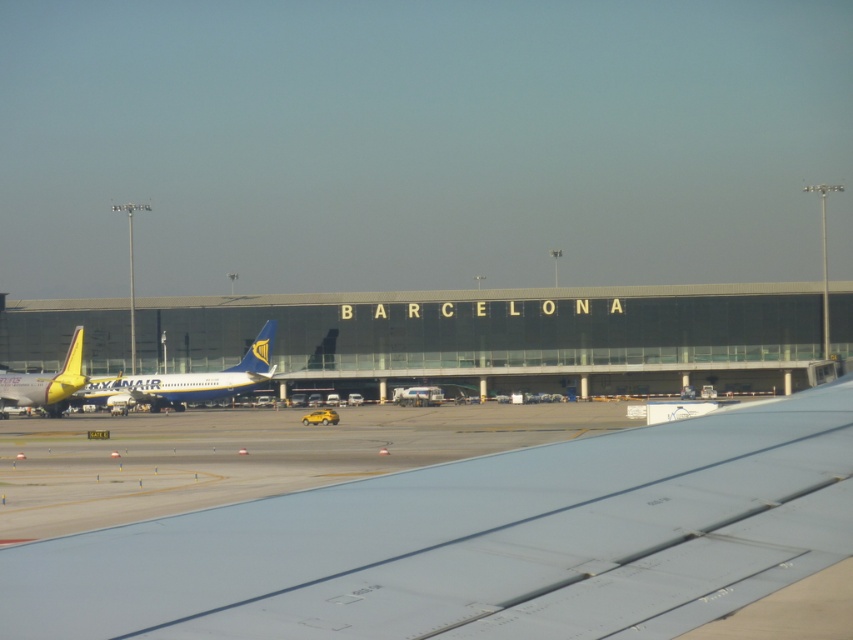
Question: Is metallic gray wing at lower center above blue metallic airplane at center?

Choices:
 (A) no
 (B) yes

Answer: (B)

Question: Among these points, which one is nearest to the camera?

Choices:
 (A) (256, 352)
 (B) (773, 504)
 (C) (39, 397)

Answer: (B)

Question: Which point is farther to the camera?

Choices:
 (A) (827, 484)
 (B) (74, 356)
 (C) (251, 378)

Answer: (C)

Question: Where is metallic gray wing at lower center located in relation to yellow matte airplane at left in the image?

Choices:
 (A) left
 (B) right

Answer: (B)

Question: Can you confirm if blue metallic airplane at center is wider than yellow matte airplane at left?

Choices:
 (A) yes
 (B) no

Answer: (B)

Question: Which of the following is the farthest from the observer?

Choices:
 (A) metallic gray wing at lower center
 (B) blue metallic airplane at center

Answer: (B)